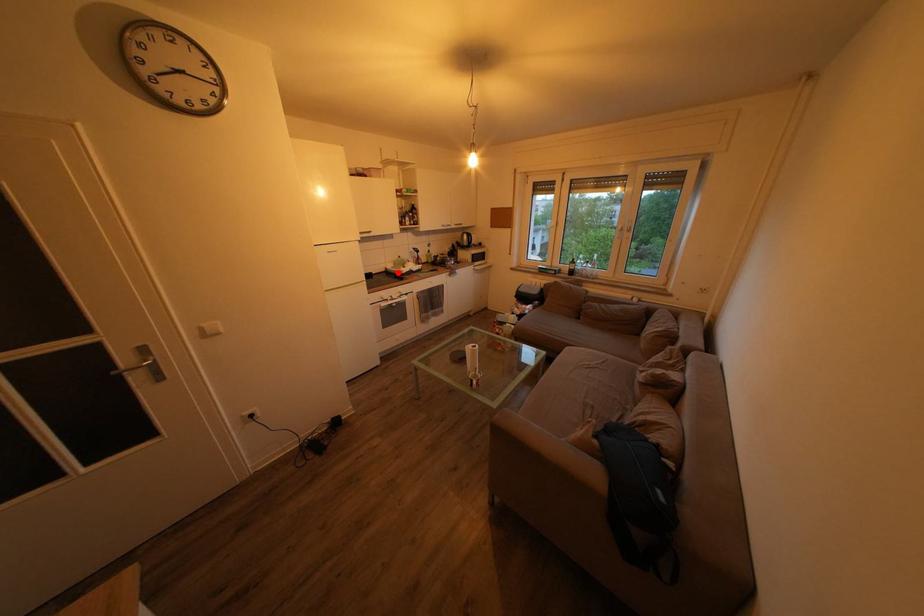
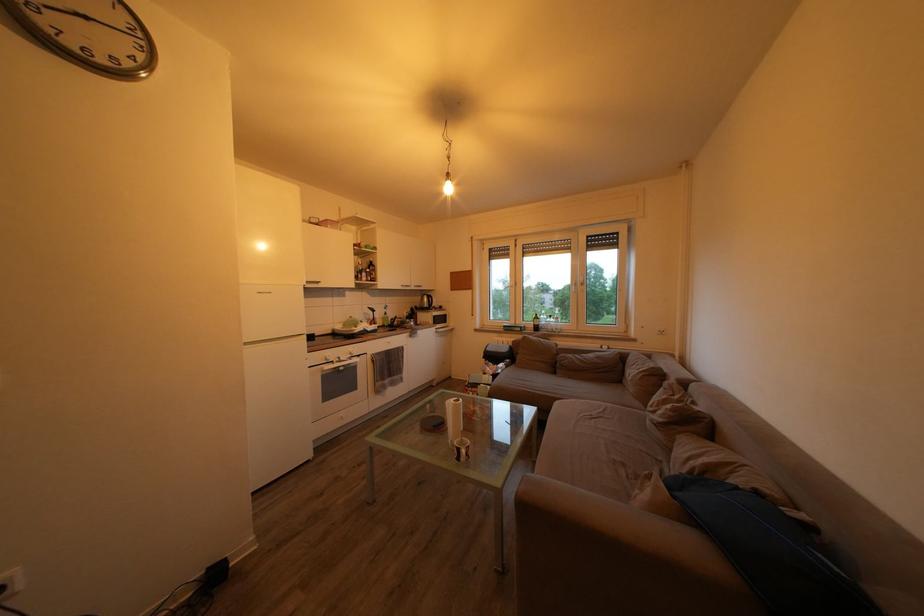
Question: I am providing you with two images of the same scene from different viewpoints. Given a red point in image1, look at the same physical point in image2. Is it:

Choices:
 (A) Closer to the viewpoint
 (B) Farther from the viewpoint

Answer: (B)